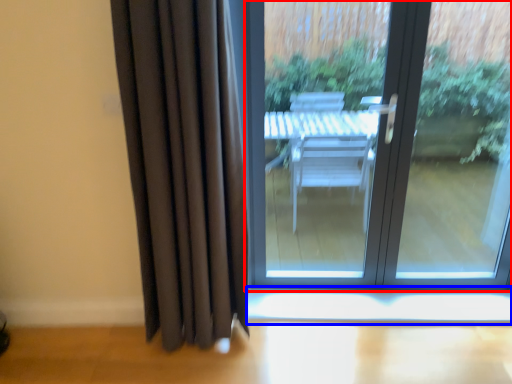
Question: Among these objects, which one is farthest to the camera, door (highlighted by a red box) or window sill (highlighted by a blue box)?

Choices:
 (A) door
 (B) window sill

Answer: (B)